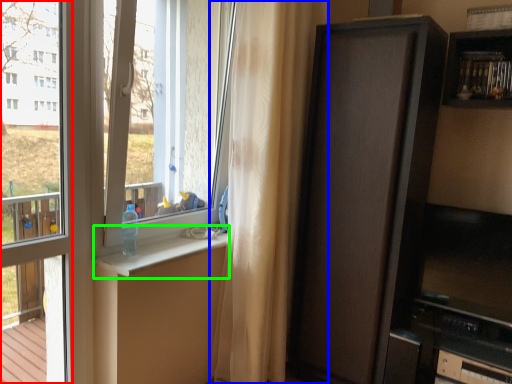
Question: Which object is the closest to the window frame (highlighted by a red box)? Choose among these: curtain (highlighted by a blue box) or window sill (highlighted by a green box).

Choices:
 (A) curtain
 (B) window sill

Answer: (B)